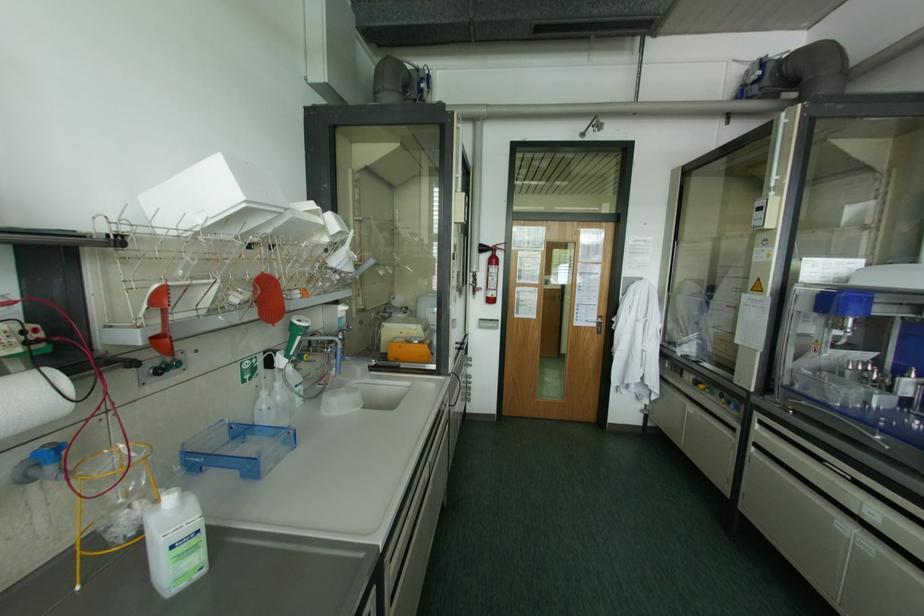
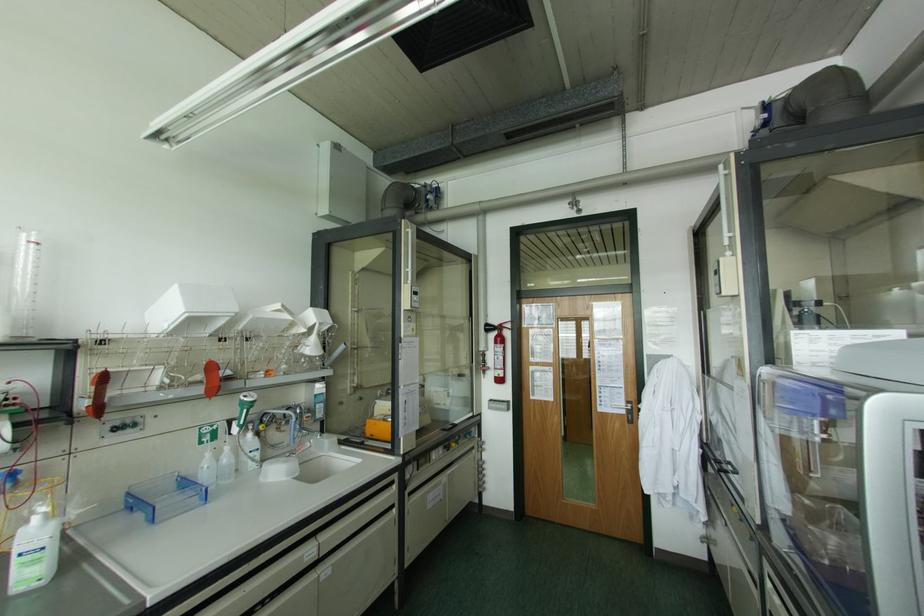
Find the pixel in the second image that matches point 276,383 in the first image.

(226, 448)